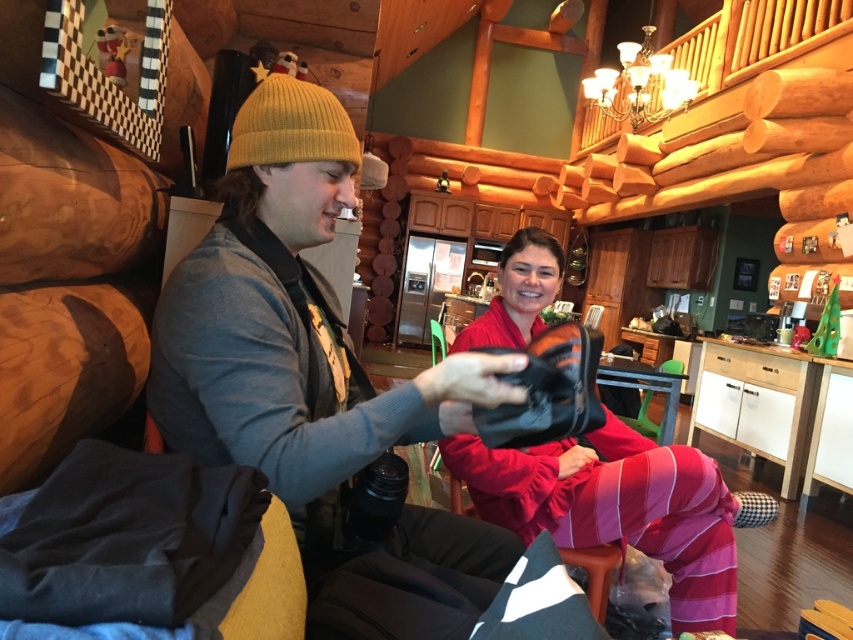
Question: Which point is closer to the camera?

Choices:
 (A) matte black shoe at center
 (B) matte black boot at center

Answer: (A)

Question: Which of the following is the closest to the observer?

Choices:
 (A) matte black boot at center
 (B) matte black shoe at center

Answer: (B)

Question: Observing the image, what is the correct spatial positioning of matte black shoe at center in reference to matte black boot at center?

Choices:
 (A) left
 (B) right

Answer: (A)

Question: Does matte black shoe at center have a smaller size compared to matte black boot at center?

Choices:
 (A) yes
 (B) no

Answer: (A)

Question: Among these points, which one is farthest from the camera?

Choices:
 (A) (250, 364)
 (B) (651, 476)

Answer: (B)

Question: Does matte black shoe at center appear on the left side of matte black boot at center?

Choices:
 (A) yes
 (B) no

Answer: (A)